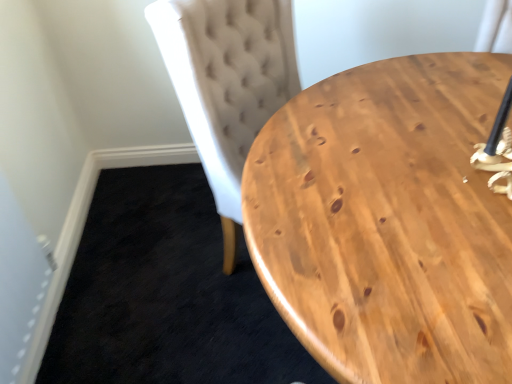
Locate an element on the screen. Image resolution: width=512 pixels, height=384 pixels. natural wood coffee table at center is located at coordinates (388, 221).

Describe the element at coordinates (388, 221) in the screenshot. I see `natural wood coffee table at center` at that location.

Find the location of `natural wood coffee table at center`. natural wood coffee table at center is located at coordinates (388, 221).